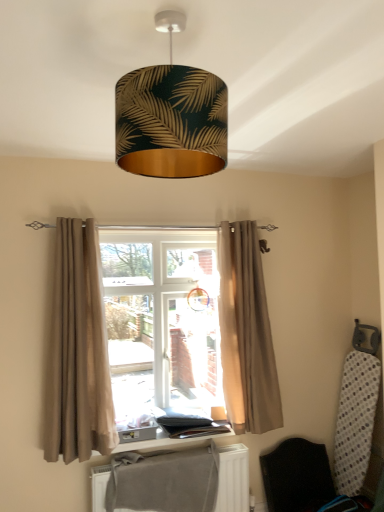
Image resolution: width=384 pixels, height=512 pixels. What are the coordinates of `gray fabric at lower center` in the screenshot? It's located at (176, 482).

Find the location of a particular element. The image size is (384, 512). black fabric folding chair at lower right is located at coordinates (297, 476).

In order to face beige fabric curtain at center, should I rotate leftwards or rightwards?

It's best to rotate left around 4.578 degrees.

You are a GUI agent. You are given a task and a screenshot of the screen. Output one action in this format:
    pyautogui.click(x=<x>, y=<y>)
    Task: Click on the beige fabric curtain at left, positioned as the second curtain in right-to-left order
    The height and width of the screenshot is (512, 384).
    Given the screenshot: What is the action you would take?
    pyautogui.click(x=78, y=350)

Locate an element on the screen. wooden window sill at center is located at coordinates (177, 439).

Measure the distance between point (97, 454) and camera.

They are 8.10 feet apart.

At what (x,y) coordinates should I click in order to perform the action: click on beige fabric curtain at center, which appears as the second curtain when viewed from the left. Please return your answer as a coordinate pair (x, y). This screenshot has width=384, height=512. Looking at the image, I should click on (246, 333).

How different are the orientations of gold leaf-patterned lampshade at upper center and beige fabric curtain at center, which appears as the second curtain when viewed from the left, in degrees?

92.2 degrees separate the facing orientations of gold leaf-patterned lampshade at upper center and beige fabric curtain at center, which appears as the second curtain when viewed from the left.

Does gold leaf-patterned lampshade at upper center touch beige fabric curtain at center, which is the 1th curtain in right-to-left order?

No, gold leaf-patterned lampshade at upper center is not beside beige fabric curtain at center, which is the 1th curtain in right-to-left order.

Who is shorter, gold leaf-patterned lampshade at upper center or beige fabric curtain at center, which appears as the second curtain when viewed from the left?

gold leaf-patterned lampshade at upper center.

Considering the sizes of objects gold leaf-patterned lampshade at upper center and beige fabric curtain at center, which appears as the second curtain when viewed from the left, in the image provided, who is smaller, gold leaf-patterned lampshade at upper center or beige fabric curtain at center, which appears as the second curtain when viewed from the left,?

gold leaf-patterned lampshade at upper center is smaller.

What's the angular difference between gold leaf-patterned lampshade at upper center and beige fabric curtain at left, positioned as the second curtain in right-to-left order,'s facing directions?

The angle between the facing direction of gold leaf-patterned lampshade at upper center and the facing direction of beige fabric curtain at left, positioned as the second curtain in right-to-left order, is 91.2 degrees.

From a real-world perspective, which object stands above the other?

In real-world perspective, gold leaf-patterned lampshade at upper center is above.

From the picture: From the image's perspective, does gold leaf-patterned lampshade at upper center appear higher than beige fabric curtain at left, positioned as the second curtain in right-to-left order?

Yes.

Locate an element on the screen. Image resolution: width=384 pixels, height=512 pixels. curtain to the left of gold leaf-patterned lampshade at upper center is located at coordinates (78, 350).

From a real-world perspective, is beige fabric curtain at center over gold leaf-patterned lampshade at upper center?

Actually, beige fabric curtain at center is physically below gold leaf-patterned lampshade at upper center in the real world.

Based on the photo, between beige fabric curtain at center and gold leaf-patterned lampshade at upper center, which one has larger width?

Wider between the two is gold leaf-patterned lampshade at upper center.

Considering the relative sizes of beige fabric curtain at center and gold leaf-patterned lampshade at upper center in the image provided, is beige fabric curtain at center shorter than gold leaf-patterned lampshade at upper center?

Incorrect, the height of beige fabric curtain at center does not fall short of that of gold leaf-patterned lampshade at upper center.

Based on the photo, can you confirm if beige fabric curtain at center is positioned to the right of gold leaf-patterned lampshade at upper center?

In fact, beige fabric curtain at center is to the left of gold leaf-patterned lampshade at upper center.

Which is correct: beige fabric curtain at center is inside black fabric folding chair at lower right, or outside of it?

beige fabric curtain at center exists outside the volume of black fabric folding chair at lower right.

In the scene shown: From a real-world perspective, is beige fabric curtain at center positioned above or below black fabric folding chair at lower right?

beige fabric curtain at center is above black fabric folding chair at lower right.

How distant is beige fabric curtain at center from black fabric folding chair at lower right?

A distance of 39.15 inches exists between beige fabric curtain at center and black fabric folding chair at lower right.

You are a GUI agent. You are given a task and a screenshot of the screen. Output one action in this format:
    pyautogui.click(x=<x>, y=<y>)
    Task: Click on the bay window on the left side of black fabric folding chair at lower right
    This screenshot has height=512, width=384.
    Given the screenshot: What is the action you would take?
    pyautogui.click(x=161, y=319)

Does gray fabric at lower center turn towards black fabric folding chair at lower right?

No, gray fabric at lower center is not facing towards black fabric folding chair at lower right.

Consider the image. Can you tell me how much gray fabric at lower center and black fabric folding chair at lower right differ in facing direction?

0.423 degrees.

From a real-world perspective, between gray fabric at lower center and black fabric folding chair at lower right, who is vertically higher?

gray fabric at lower center is physically above.

From the image's perspective, which object appears higher, gray fabric at lower center or black fabric folding chair at lower right?

gray fabric at lower center.

How many degrees apart are the facing directions of beige fabric curtain at center, which appears as the second curtain when viewed from the left, and beige fabric curtain at left, the 1th curtain viewed from the left?

There is a 0.948-degree angle between the facing directions of beige fabric curtain at center, which appears as the second curtain when viewed from the left, and beige fabric curtain at left, the 1th curtain viewed from the left.

From a real-world perspective, is beige fabric curtain at center, which is the 1th curtain in right-to-left order, over beige fabric curtain at left, the 1th curtain viewed from the left?

Yes, from a real-world perspective, beige fabric curtain at center, which is the 1th curtain in right-to-left order, is over beige fabric curtain at left, the 1th curtain viewed from the left

Is beige fabric curtain at center, which appears as the second curtain when viewed from the left, closer to the viewer compared to beige fabric curtain at left, the 1th curtain viewed from the left?

No, beige fabric curtain at center, which appears as the second curtain when viewed from the left, is further to the viewer.

Between beige fabric curtain at center, which appears as the second curtain when viewed from the left, and beige fabric curtain at left, positioned as the second curtain in right-to-left order, which one has less height?

beige fabric curtain at left, positioned as the second curtain in right-to-left order.

From the image's perspective, between gray fabric at lower center and wooden window sill at center, who is located below?

gray fabric at lower center, from the image's perspective.

Is gray fabric at lower center far from wooden window sill at center?

They are positioned close to each other.

Is gray fabric at lower center facing away from wooden window sill at center?

No.

Is wooden window sill at center located within gray fabric at lower center?

No, wooden window sill at center is not inside gray fabric at lower center.

In order to click on curtain that is the 1st one below the gold leaf-patterned lampshade at upper center (from a real-world perspective) in this screenshot , I will do `click(246, 333)`.

Identify the location of curtain located on the left of gold leaf-patterned lampshade at upper center. (78, 350).

Which object lies further to the anchor point black fabric folding chair at lower right, beige fabric curtain at left, the 1th curtain viewed from the left, or gold leaf-patterned lampshade at upper center?

gold leaf-patterned lampshade at upper center.

Considering their positions, is gold leaf-patterned lampshade at upper center positioned closer to beige fabric curtain at left, the 1th curtain viewed from the left, than gray fabric at lower center?

Among the two, gray fabric at lower center is located nearer to beige fabric curtain at left, the 1th curtain viewed from the left.

Considering their positions, is wooden window sill at center positioned closer to black fabric folding chair at lower right than gold leaf-patterned lampshade at upper center?

wooden window sill at center is closer to black fabric folding chair at lower right.

Which object lies nearer to the anchor point beige fabric curtain at center, gray fabric at lower center or gold leaf-patterned lampshade at upper center?

gray fabric at lower center is closer to beige fabric curtain at center.

From the picture: Estimate the real-world distances between objects in this image. Which object is closer to beige fabric curtain at left, the 1th curtain viewed from the left, beige fabric curtain at center or black fabric folding chair at lower right?

Among the two, beige fabric curtain at center is located nearer to beige fabric curtain at left, the 1th curtain viewed from the left.

Estimate the real-world distances between objects in this image. Which object is further from black fabric folding chair at lower right, beige fabric curtain at center, which appears as the second curtain when viewed from the left, or beige fabric curtain at left, the 1th curtain viewed from the left?

beige fabric curtain at left, the 1th curtain viewed from the left, lies further to black fabric folding chair at lower right than the other object.

Looking at the image, which one is located further to black fabric folding chair at lower right, gray fabric at lower center or wooden window sill at center?

The object further to black fabric folding chair at lower right is wooden window sill at center.

When comparing their distances from beige fabric curtain at center, which is the 1th curtain in right-to-left order, does beige fabric curtain at center or gray fabric at lower center seem closer?

Based on the image, beige fabric curtain at center appears to be nearer to beige fabric curtain at center, which is the 1th curtain in right-to-left order.

Locate an element on the screen. This screenshot has width=384, height=512. curtain between beige fabric curtain at center, which is the 1th curtain in right-to-left order, and gray fabric at lower center from top to bottom is located at coordinates (78, 350).

What are the coordinates of `bay window situated between beige fabric curtain at left, the 1th curtain viewed from the left, and black fabric folding chair at lower right from left to right` in the screenshot? It's located at (161, 319).

The height and width of the screenshot is (512, 384). Find the location of `radiator between beige fabric curtain at center, which appears as the second curtain when viewed from the left, and black fabric folding chair at lower right vertically`. radiator between beige fabric curtain at center, which appears as the second curtain when viewed from the left, and black fabric folding chair at lower right vertically is located at coordinates (176, 482).

Identify the location of bay window situated between beige fabric curtain at left, positioned as the second curtain in right-to-left order, and beige fabric curtain at center, which appears as the second curtain when viewed from the left, from left to right. This screenshot has width=384, height=512. (161, 319).